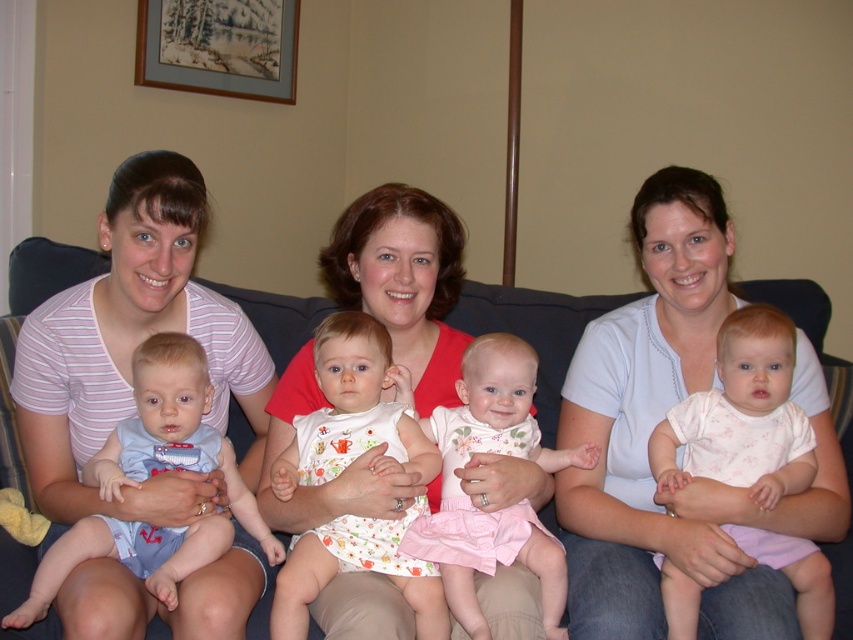
Question: Which of the following is the closest to the observer?

Choices:
 (A) wooden picture frame at upper center
 (B) blue cotton onesie at left
 (C) white cotton shirt at center

Answer: (C)

Question: Which point is farther from the camera taking this photo?

Choices:
 (A) (556, 611)
 (B) (779, 454)

Answer: (B)

Question: Can you confirm if white cotton shirt at center is bigger than white floral onesie at center?

Choices:
 (A) no
 (B) yes

Answer: (B)

Question: Can you confirm if white cotton shirt at center is smaller than floral cotton dress at center?

Choices:
 (A) no
 (B) yes

Answer: (A)

Question: Which of these objects is positioned farthest from the white cotton dress at center?

Choices:
 (A) white cotton shirt at center
 (B) floral cotton dress at center

Answer: (A)

Question: Can you confirm if floral cotton dress at center is positioned to the right of wooden picture frame at upper center?

Choices:
 (A) yes
 (B) no

Answer: (A)